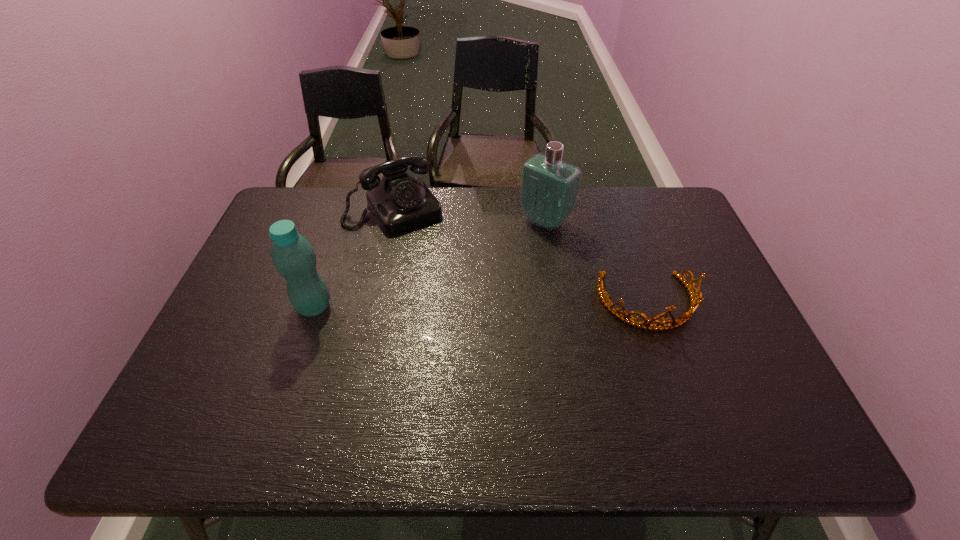
Find the location of a particular element. free spot at the left edge of the desktop is located at coordinates (257, 286).

This screenshot has width=960, height=540. In order to click on vacant space at the right edge of the desktop in this screenshot , I will do `click(695, 339)`.

The height and width of the screenshot is (540, 960). I want to click on blank space at the far left corner, so click(x=285, y=199).

In the image, there is a desktop. Where is `free region at the near left corner`? The width and height of the screenshot is (960, 540). free region at the near left corner is located at coordinates (190, 380).

Where is `free space at the near right corner of the desktop`? free space at the near right corner of the desktop is located at coordinates (742, 382).

This screenshot has width=960, height=540. Find the location of `vacant area that lies between the shortest object and the third tallest object`. vacant area that lies between the shortest object and the third tallest object is located at coordinates (521, 256).

At what (x,y) coordinates should I click in order to perform the action: click on free area in between the tiara and the third object from left to right. Please return your answer as a coordinate pair (x, y). The width and height of the screenshot is (960, 540). Looking at the image, I should click on (596, 262).

At what (x,y) coordinates should I click in order to perform the action: click on free spot between the second object from right to left and the telephone. Please return your answer as a coordinate pair (x, y). This screenshot has width=960, height=540. Looking at the image, I should click on tap(469, 215).

Locate an element on the screen. The image size is (960, 540). free area in between the water bottle and the third object from left to right is located at coordinates (429, 264).

This screenshot has width=960, height=540. Find the location of `vacant region between the rightmost object and the perfume`. vacant region between the rightmost object and the perfume is located at coordinates (596, 262).